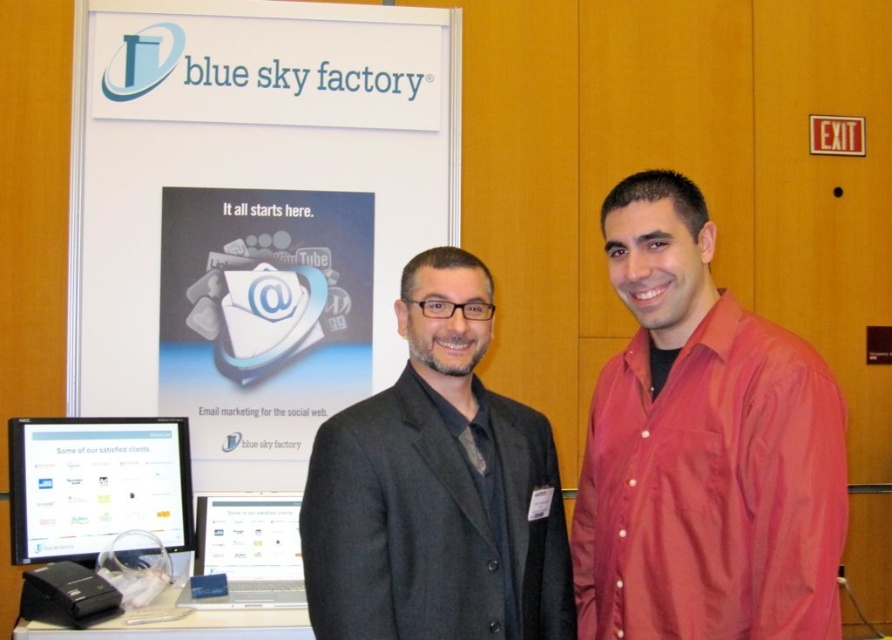
Is white paperboard at upper center wider than red satin shirt at right?

Indeed, white paperboard at upper center has a greater width compared to red satin shirt at right.

Does white paperboard at upper center appear over red satin shirt at right?

Yes.

Which is behind, point (136, 49) or point (686, 316)?

Positioned behind is point (136, 49).

Find the location of a particular element. white paperboard at upper center is located at coordinates (252, 212).

Does matte black monitor at lower left have a greater height compared to satin silver laptop at center?

Correct, matte black monitor at lower left is much taller as satin silver laptop at center.

Is point (68, 465) behind point (235, 516)?

No, (68, 465) is closer to viewer.

Does point (131, 496) come behind point (178, 598)?

Yes, it is.

What are the coordinates of `matte black monitor at lower left` in the screenshot? It's located at (96, 484).

Based on the photo, does red satin shirt at right appear over satin silver laptop at center?

Yes, red satin shirt at right is above satin silver laptop at center.

Does red satin shirt at right have a smaller size compared to satin silver laptop at center?

Incorrect, red satin shirt at right is not smaller in size than satin silver laptop at center.

Which is behind, point (615, 564) or point (254, 532)?

The point (254, 532) is behind.

Locate an element on the screen. Image resolution: width=892 pixels, height=640 pixels. red satin shirt at right is located at coordinates (703, 449).